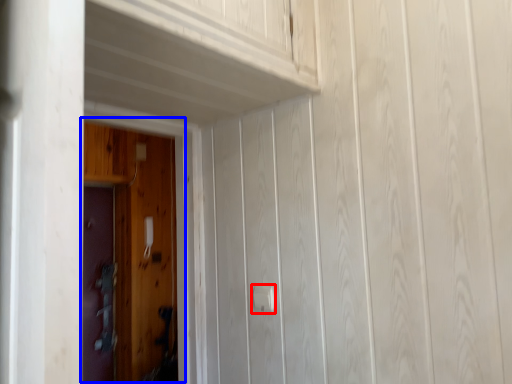
Question: Among these objects, which one is farthest to the camera, door handle (highlighted by a red box) or door (highlighted by a blue box)?

Choices:
 (A) door handle
 (B) door

Answer: (A)